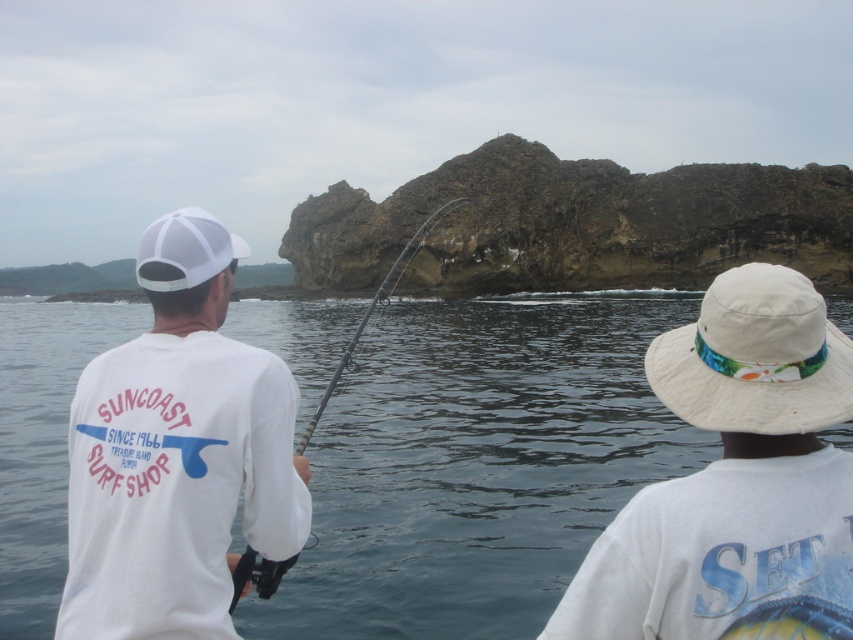
Image resolution: width=853 pixels, height=640 pixels. What do you see at coordinates (755, 356) in the screenshot? I see `white fabric hat at right` at bounding box center [755, 356].

Between white fabric hat at right and white mesh cap at upper left, which one appears on the left side from the viewer's perspective?

Positioned to the left is white mesh cap at upper left.

Is point (784, 417) in front of point (190, 250)?

Yes, point (784, 417) is closer to viewer.

Locate an element on the screen. The image size is (853, 640). white fabric hat at right is located at coordinates (755, 356).

Between white fabric hat at upper right and white fabric hat at right, which one has more height?

white fabric hat at right is taller.

Is point (714, 532) positioned before point (775, 364)?

That is True.

You are a GUI agent. You are given a task and a screenshot of the screen. Output one action in this format:
    pyautogui.click(x=<x>, y=<y>)
    Task: Click on the white fabric hat at upper right
    This screenshot has width=853, height=640.
    Given the screenshot: What is the action you would take?
    pyautogui.click(x=735, y=481)

At what (x,y) coordinates should I click in order to perform the action: click on white fabric hat at upper right. Please return your answer as a coordinate pair (x, y). Image resolution: width=853 pixels, height=640 pixels. Looking at the image, I should click on (735, 481).

Who is positioned more to the right, white fabric hat at upper right or white mesh cap at upper left?

Positioned to the right is white fabric hat at upper right.

Can you confirm if white fabric hat at upper right is shorter than white mesh cap at upper left?

Incorrect, white fabric hat at upper right's height does not fall short of white mesh cap at upper left's.

Describe the element at coordinates (735, 481) in the screenshot. I see `white fabric hat at upper right` at that location.

Identify the location of white fabric hat at upper right. (735, 481).